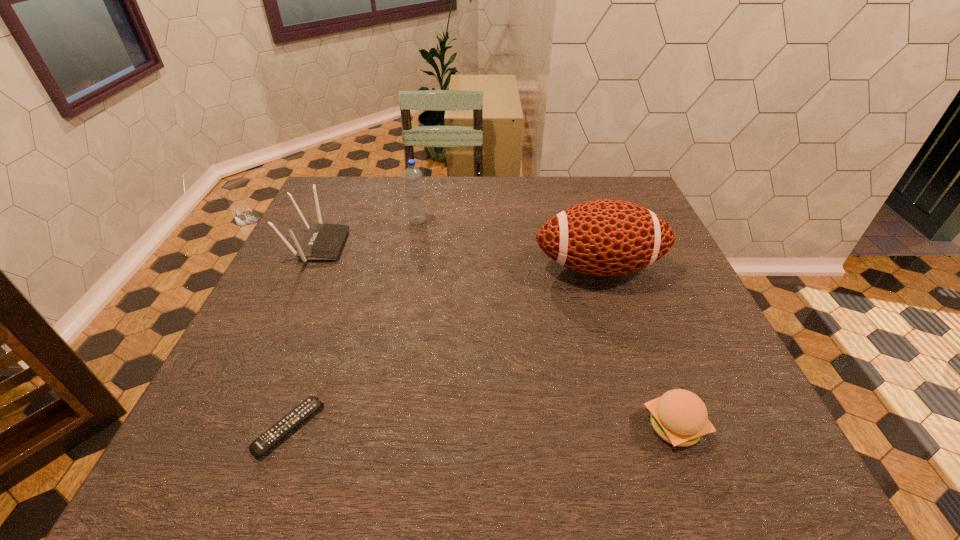
The width and height of the screenshot is (960, 540). Identify the location of object that is at the far edge. (412, 175).

Where is `hamburger that is positioned at the near edge`? Image resolution: width=960 pixels, height=540 pixels. hamburger that is positioned at the near edge is located at coordinates (x=680, y=417).

In order to click on remote control at the near edge in this screenshot , I will do `click(289, 422)`.

This screenshot has width=960, height=540. What are the coordinates of `router positioned at the left edge` in the screenshot? It's located at (323, 241).

Locate an element on the screen. The height and width of the screenshot is (540, 960). remote control located at the left edge is located at coordinates (289, 422).

Locate an element on the screen. Image resolution: width=960 pixels, height=540 pixels. football that is at the right edge is located at coordinates (x=607, y=237).

Where is `hamburger that is at the right edge`? The image size is (960, 540). hamburger that is at the right edge is located at coordinates (680, 417).

This screenshot has height=540, width=960. Find the location of `object located in the near left corner section of the desktop`. object located in the near left corner section of the desktop is located at coordinates (289, 422).

Find the location of `object that is positioned at the near right corner`. object that is positioned at the near right corner is located at coordinates (680, 417).

This screenshot has width=960, height=540. I want to click on free space at the far edge of the desktop, so click(506, 195).